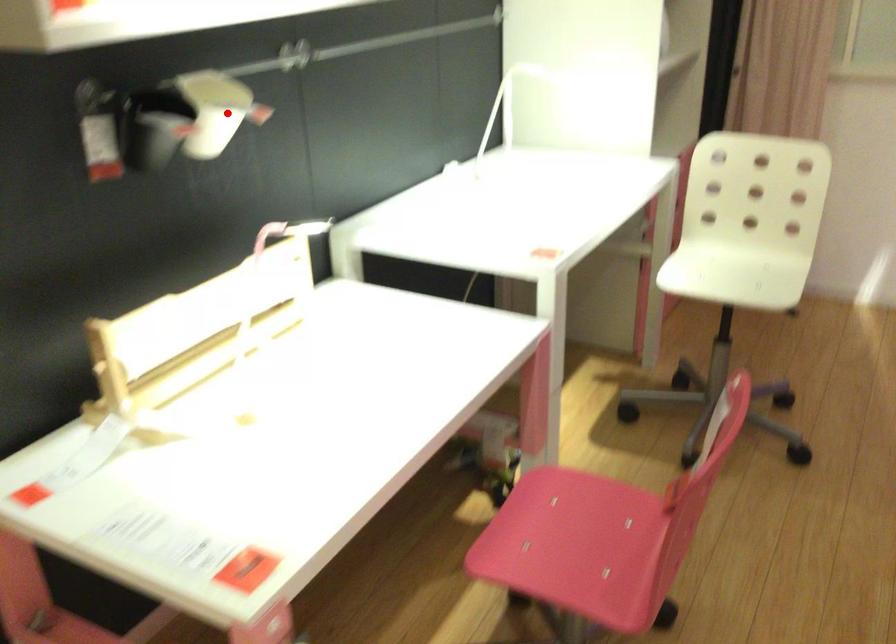
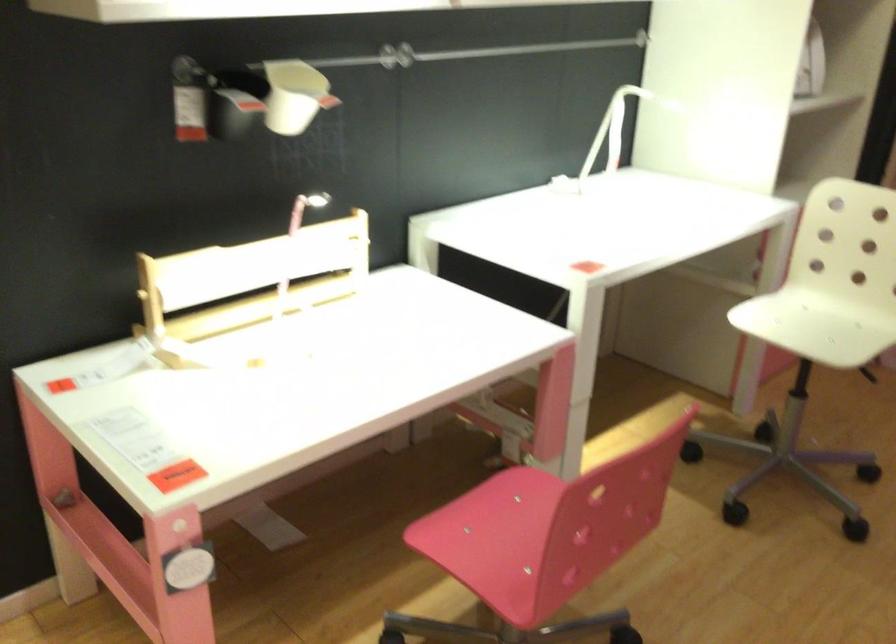
The point at the highlighted location is marked in the first image. Where is the corresponding point in the second image?

(295, 96)